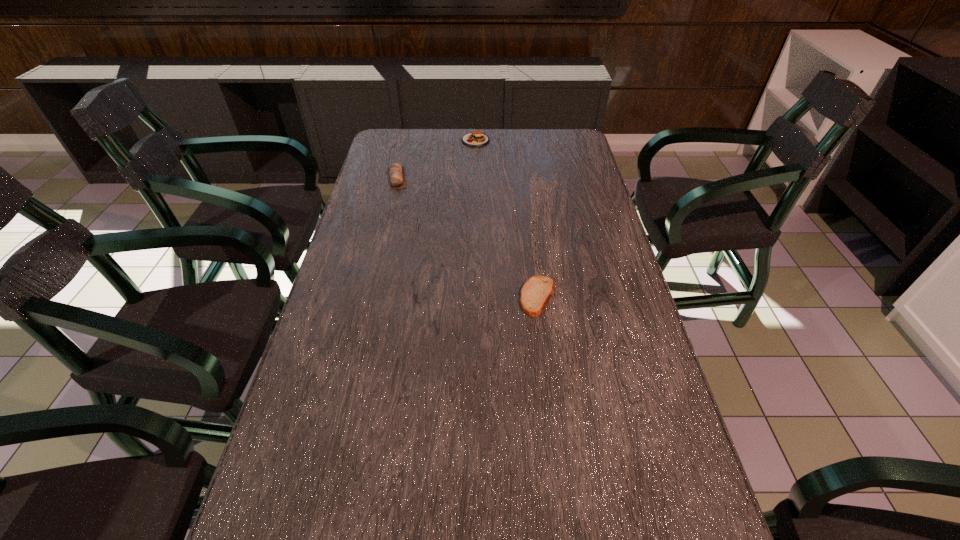
The image size is (960, 540). Identify the location of object situated at the left edge. (396, 177).

The width and height of the screenshot is (960, 540). Identify the location of free space at the far edge of the desktop. (507, 147).

In the image, there is a desktop. Where is `free space at the left edge`? free space at the left edge is located at coordinates (379, 337).

The height and width of the screenshot is (540, 960). In order to click on free space at the right edge of the desktop in this screenshot , I will do `click(583, 259)`.

The width and height of the screenshot is (960, 540). In order to click on free space at the far right corner in this screenshot , I will do `click(580, 154)`.

Find the location of a particular element. The height and width of the screenshot is (540, 960). empty location between the farthest object and the farther pita bread is located at coordinates (436, 159).

You are a GUI agent. You are given a task and a screenshot of the screen. Output one action in this format:
    pyautogui.click(x=<x>, y=<y>)
    Task: Click on the vacant area between the patty (food) and the second nearest object
    The height and width of the screenshot is (540, 960).
    Given the screenshot: What is the action you would take?
    pyautogui.click(x=436, y=159)

What are the coordinates of `free point between the right pita bread and the farthest object` in the screenshot? It's located at (507, 219).

You are a GUI agent. You are given a task and a screenshot of the screen. Output one action in this format:
    pyautogui.click(x=<x>, y=<y>)
    Task: Click on the free space between the patty (food) and the leftmost object
    The image size is (960, 540).
    Given the screenshot: What is the action you would take?
    pyautogui.click(x=436, y=159)

Identify the location of free spot between the second object from right to left and the rightmost object. (507, 219).